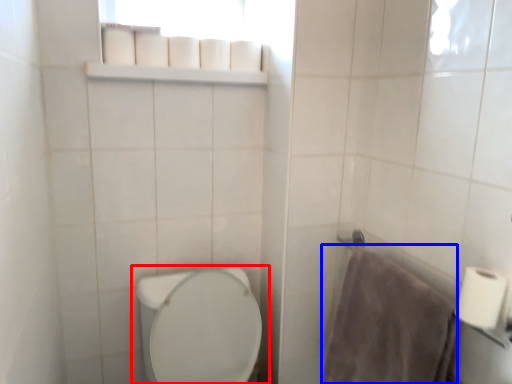
Question: Which of the following is the farthest to the observer, toilet (highlighted by a red box) or bath towel (highlighted by a blue box)?

Choices:
 (A) toilet
 (B) bath towel

Answer: (B)